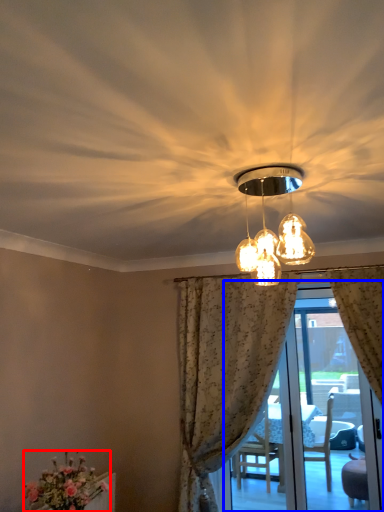
Question: Which object appears closest to the camera in this image, flower (highlighted by a red box) or screen door (highlighted by a blue box)?

Choices:
 (A) flower
 (B) screen door

Answer: (A)